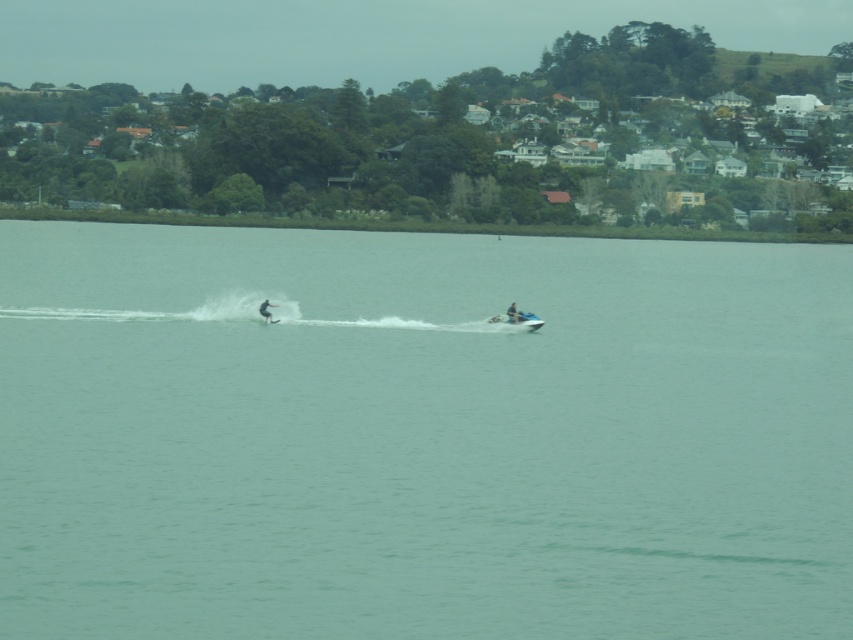
Question: Does white plastic boat at center appear over white matte surfboard at center?

Choices:
 (A) no
 (B) yes

Answer: (A)

Question: Can you confirm if white plastic boat at center is thinner than white matte surfboard at center?

Choices:
 (A) no
 (B) yes

Answer: (A)

Question: Which of the following is the closest to the observer?

Choices:
 (A) white matte surfboard at center
 (B) white plastic boat at center
 (C) clear water at center

Answer: (C)

Question: Which of the following is the closest to the observer?

Choices:
 (A) clear water at center
 (B) white plastic boat at center

Answer: (A)

Question: Is clear water at center further to the viewer compared to white plastic boat at center?

Choices:
 (A) no
 (B) yes

Answer: (A)

Question: Based on their relative distances, which object is nearer to the clear water at center?

Choices:
 (A) white matte surfboard at center
 (B) white plastic boat at center

Answer: (B)